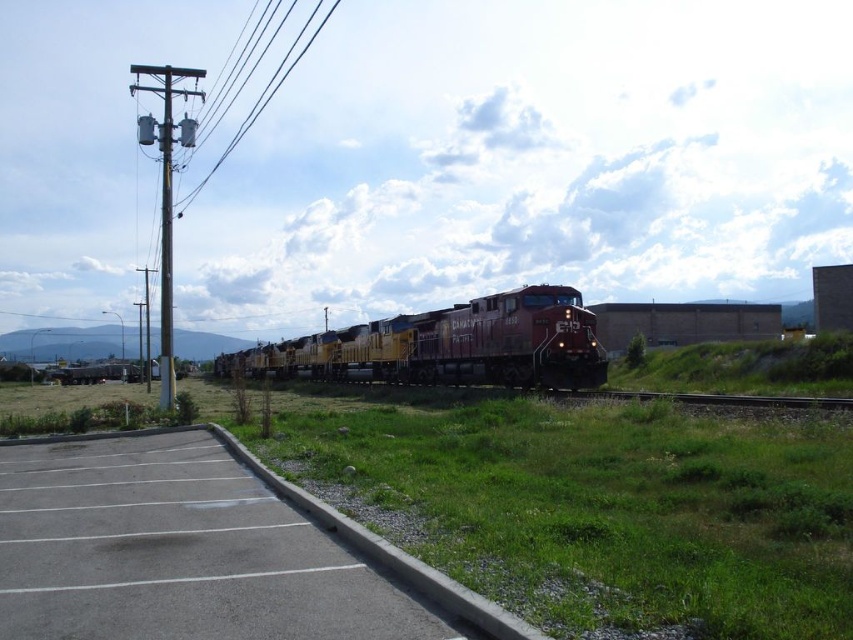
Question: Can you confirm if gray asphalt parking lot at lower left is thinner than metallic pole at left?

Choices:
 (A) yes
 (B) no

Answer: (A)

Question: Can you confirm if green grass at lower center is positioned to the left of gray asphalt parking lot at lower left?

Choices:
 (A) yes
 (B) no

Answer: (A)

Question: Can you confirm if gray asphalt parking lot at lower left is positioned to the left of metallic pole at left?

Choices:
 (A) no
 (B) yes

Answer: (A)

Question: Which object is positioned farthest from the reddish-brown metal train at center?

Choices:
 (A) gray asphalt parking lot at lower left
 (B) metallic pole at left
 (C) green grass at lower center

Answer: (B)

Question: Which object appears closest to the camera in this image?

Choices:
 (A) green grass at lower center
 (B) metallic pole at left

Answer: (A)

Question: Which of the following is the closest to the observer?

Choices:
 (A) metallic pole at left
 (B) reddish-brown metal train at center

Answer: (B)